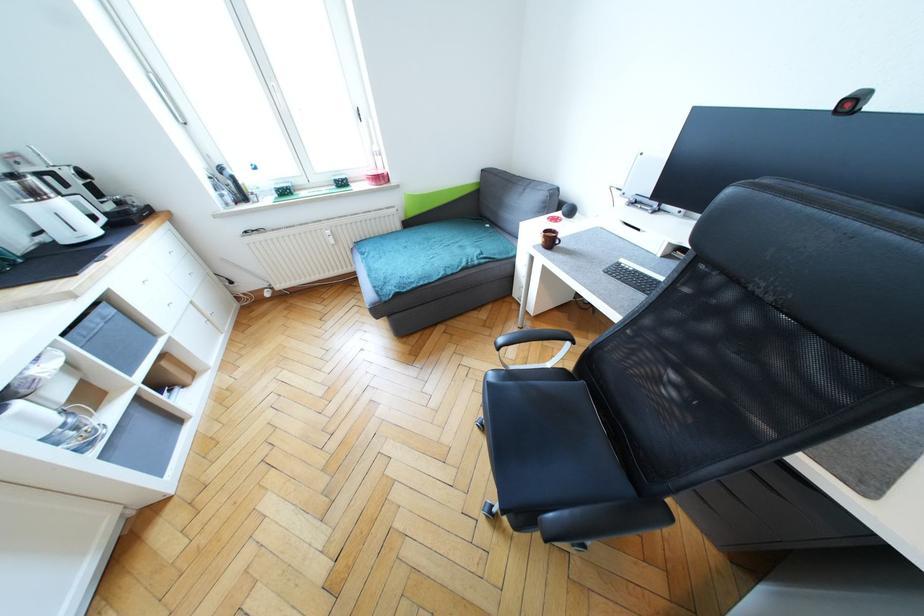
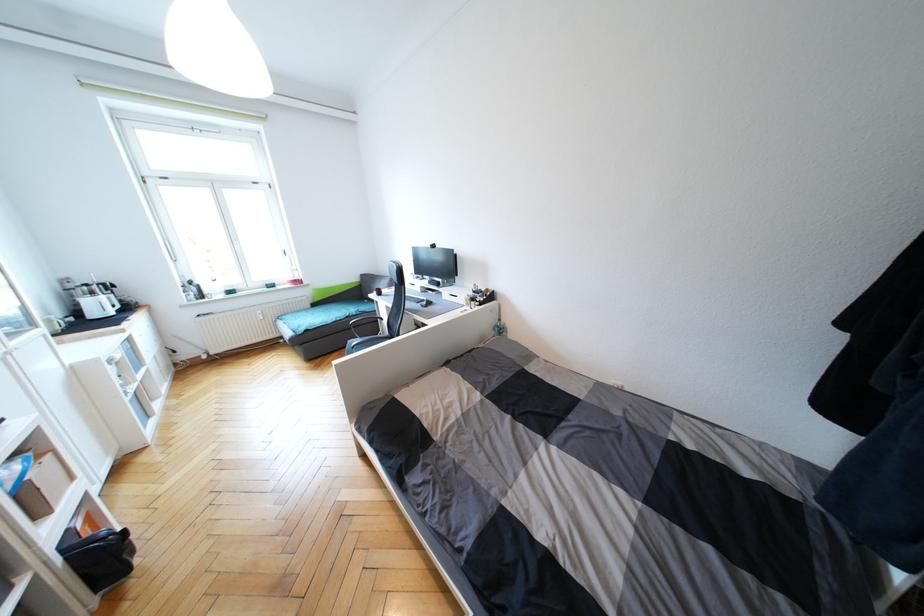
Where in the second image is the point corresponding to [40,196] from the first image?

(95, 294)